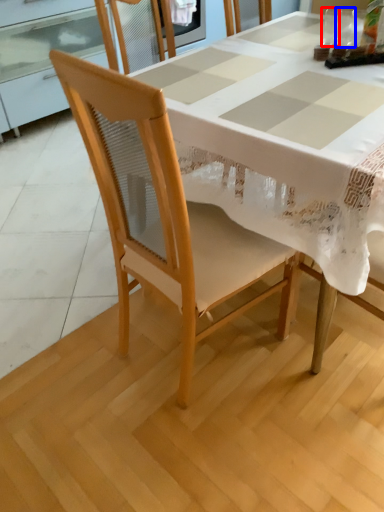
Question: Among these objects, which one is nearest to the camera, tableware (highlighted by a red box) or tableware (highlighted by a blue box)?

Choices:
 (A) tableware
 (B) tableware

Answer: (A)